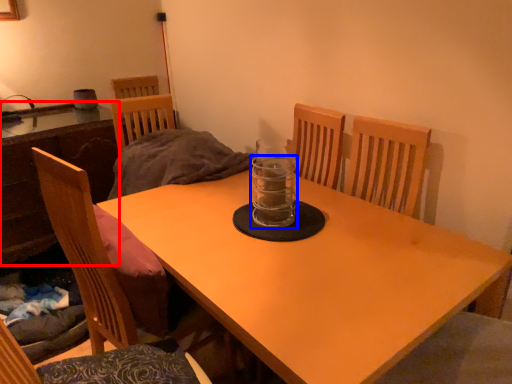
Question: Which object is closer to the camera taking this photo, table (highlighted by a red box) or glass jar (highlighted by a blue box)?

Choices:
 (A) table
 (B) glass jar

Answer: (B)